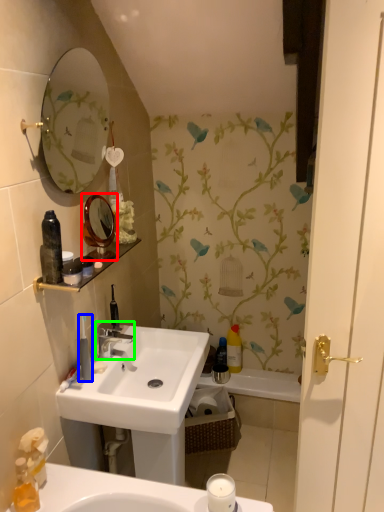
Question: Which object is the closest to the mirror (highlighted by a red box)? Choose among these: toiletry (highlighted by a blue box) or tap (highlighted by a green box).

Choices:
 (A) toiletry
 (B) tap

Answer: (A)